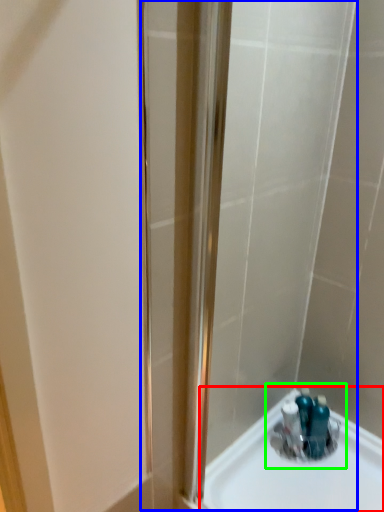
Question: Estimate the real-world distances between objects in this image. Which object is closer to sink (highlighted by a red box), shower door (highlighted by a blue box) or sink (highlighted by a green box)?

Choices:
 (A) shower door
 (B) sink

Answer: (B)